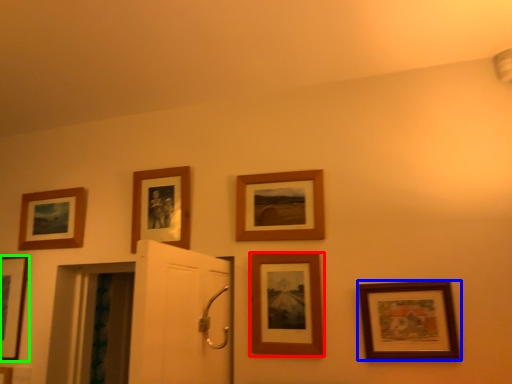
Question: Considering the real-world distances, which object is closest to picture frame (highlighted by a red box)? picture frame (highlighted by a blue box) or picture frame (highlighted by a green box).

Choices:
 (A) picture frame
 (B) picture frame

Answer: (A)